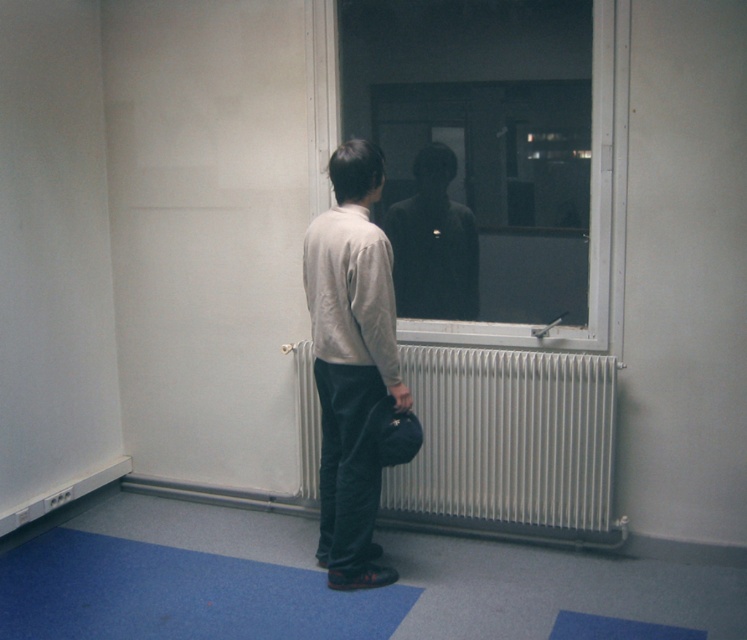
Question: Where is blue carpet at lower left located in relation to transparent glass window at center in the image?

Choices:
 (A) below
 (B) above

Answer: (A)

Question: Is blue carpet at lower left to the right of dark matte figure at center from the viewer's perspective?

Choices:
 (A) yes
 (B) no

Answer: (B)

Question: Estimate the real-world distances between objects in this image. Which object is farther from the dark matte figure at center?

Choices:
 (A) white metallic radiator at center
 (B) light beige sweater at center
 (C) blue carpet at lower left

Answer: (C)

Question: Is white metallic radiator at center wider than transparent glass window at center?

Choices:
 (A) no
 (B) yes

Answer: (B)

Question: Based on their relative distances, which object is farther from the dark matte figure at center?

Choices:
 (A) blue carpet at lower left
 (B) transparent glass window at center
 (C) white metallic radiator at center

Answer: (A)

Question: Which point appears farthest from the camera in this image?

Choices:
 (A) (x=86, y=573)
 (B) (x=498, y=404)

Answer: (B)